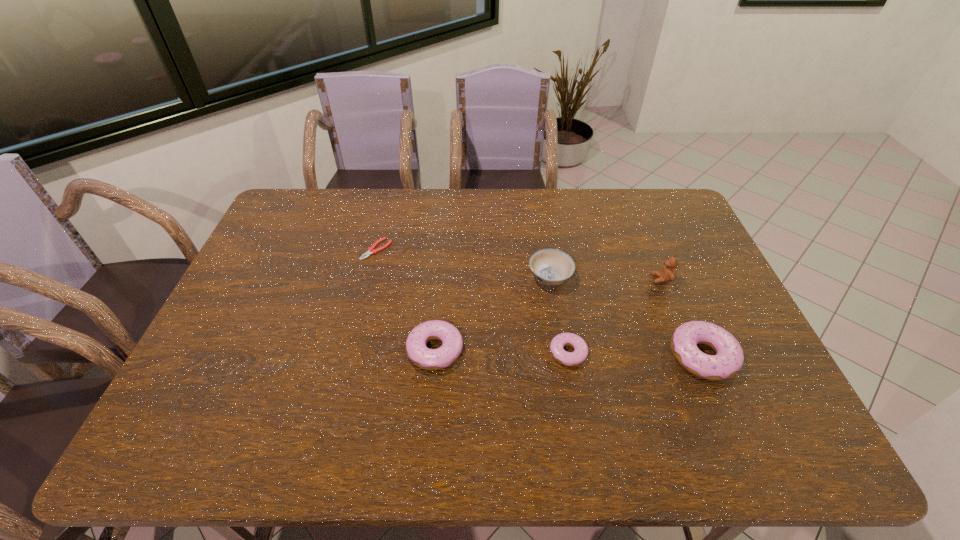
Identify the location of object located at the near right corner. (729, 358).

Find the location of `free space at the far edge`. free space at the far edge is located at coordinates (427, 196).

Where is `free location at the near edge`? Image resolution: width=960 pixels, height=540 pixels. free location at the near edge is located at coordinates (330, 381).

The image size is (960, 540). Find the location of `free region at the left edge of the desktop`. free region at the left edge of the desktop is located at coordinates (252, 324).

Find the location of a particular element. This screenshot has width=960, height=540. free space at the right edge of the desktop is located at coordinates (699, 252).

What are the coordinates of `vacant area at the far left corner of the desktop` in the screenshot? It's located at (324, 195).

This screenshot has width=960, height=540. In order to click on free space at the near left corner of the desktop in this screenshot , I will do `click(185, 397)`.

You are a GUI agent. You are given a task and a screenshot of the screen. Output one action in this format:
    pyautogui.click(x=<x>, y=<y>)
    Task: Click on the vacant area that lies between the pliers and the tallest object
    
    Given the screenshot: What is the action you would take?
    pyautogui.click(x=519, y=265)

Locate an element on the screen. vacant space that is in between the leftmost object and the second tallest doughnut is located at coordinates (406, 300).

At what (x,y) coordinates should I click in order to perform the action: click on free space between the bowl and the farthest object. Please return your answer as a coordinate pair (x, y). Looking at the image, I should click on (464, 264).